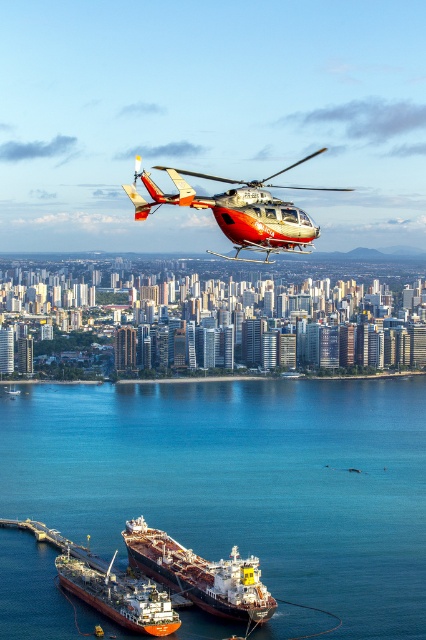
Question: Does blue water at lower center appear on the right side of brown matte cargo ship at lower center?

Choices:
 (A) yes
 (B) no

Answer: (A)

Question: Is metallic silver helicopter at center positioned behind brown matte cargo ship at lower center?

Choices:
 (A) no
 (B) yes

Answer: (A)

Question: Which point appears closest to the camera in this image?

Choices:
 (A) (230, 237)
 (B) (209, 580)
 (C) (236, 438)
 (D) (117, 586)

Answer: (C)

Question: Estimate the real-world distances between objects in this image. Which object is closer to the metallic silver helicopter at center?

Choices:
 (A) red matte tanker ship at lower center
 (B) brown matte cargo ship at lower center
 (C) blue water at lower center

Answer: (C)

Question: Can you confirm if blue water at lower center is wider than brown matte cargo ship at lower center?

Choices:
 (A) yes
 (B) no

Answer: (A)

Question: Which point is farther to the camera?

Choices:
 (A) (311, 385)
 (B) (123, 598)
 (C) (166, 545)

Answer: (B)